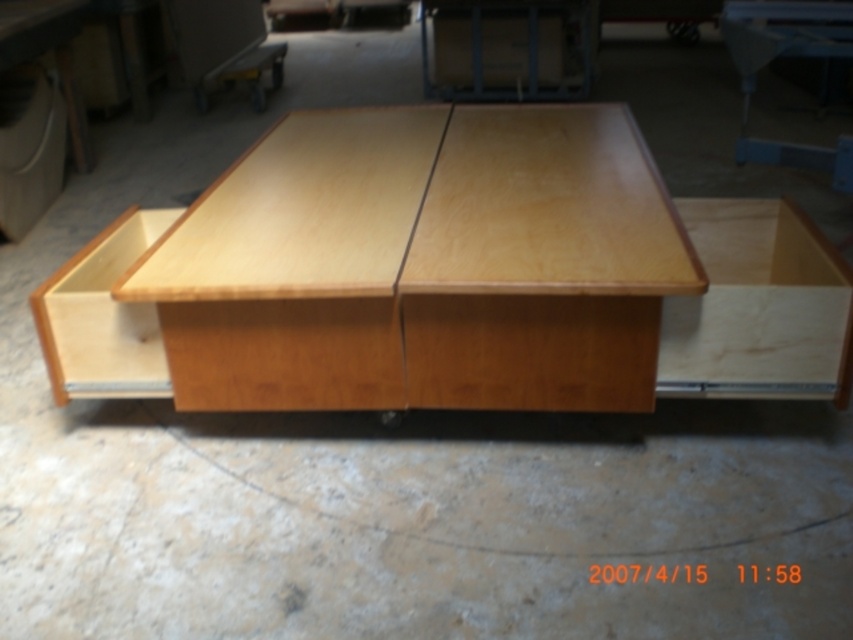
You are organizing tools in a workshop. You have a tool that needs to be placed on a surface. Which object should you choose between the light wood table at center and the light wood drawer at lower left if you want to place it on the right side of the drawer?

You should place the tool on the light wood table at center because it is located to the right of the light wood drawer at lower left, as stated in the description.

From the picture: You are organizing tools in a workshop and need to place a new tool box. The light wood table at center and the light wood drawer at lower left are both potential locations. Which object is closer to you if you are standing at the entrance of the workshop?

The light wood table at center is closer to you because it is in front of the light wood drawer at lower left, meaning it is nearer to your position at the entrance.